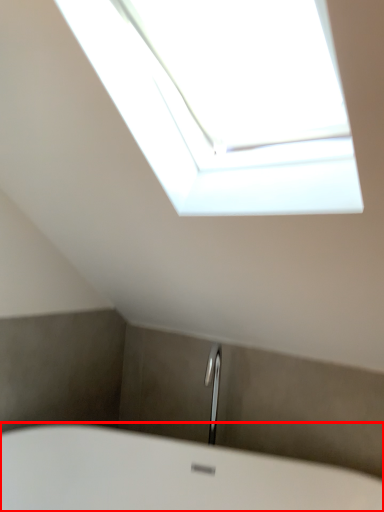
Question: From the image's perspective, where is bathtub (annotated by the red box) located relative to window?

Choices:
 (A) below
 (B) above

Answer: (A)